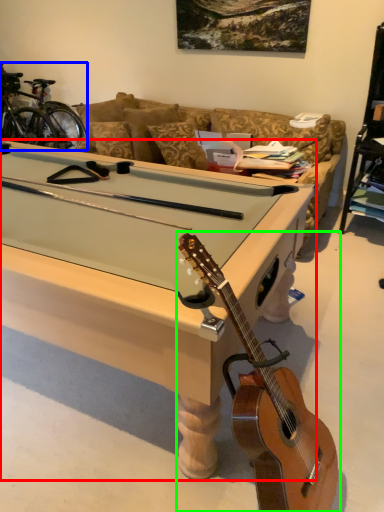
Question: Which object is positioned farthest from desk (highlighted by a red box)? Select from bicycle (highlighted by a blue box) and guitar (highlighted by a green box).

Choices:
 (A) bicycle
 (B) guitar

Answer: (A)